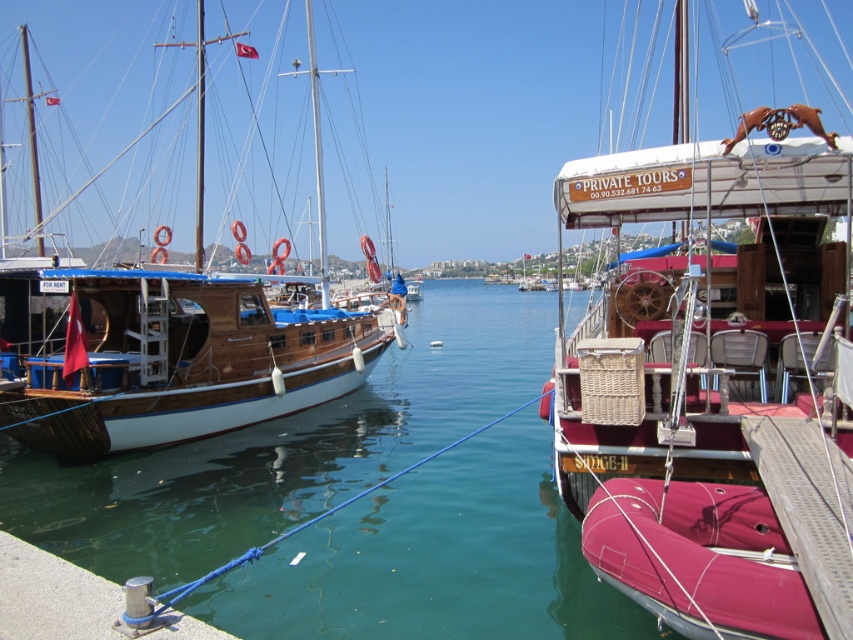
Question: Which point is closer to the camera?

Choices:
 (A) wooden sailboat at left
 (B) wooden sailboat at center

Answer: (B)

Question: Does wooden sailboat at center have a lesser width compared to green water at center?

Choices:
 (A) yes
 (B) no

Answer: (A)

Question: Does wooden sailboat at center lie behind wooden sailboat at left?

Choices:
 (A) no
 (B) yes

Answer: (A)

Question: Which is nearer to the green water at center?

Choices:
 (A) wooden sailboat at left
 (B) wooden sailboat at center

Answer: (A)

Question: Which object appears closest to the camera in this image?

Choices:
 (A) wooden sailboat at center
 (B) wooden sailboat at left

Answer: (A)

Question: Is wooden sailboat at center bigger than wooden sailboat at left?

Choices:
 (A) yes
 (B) no

Answer: (A)